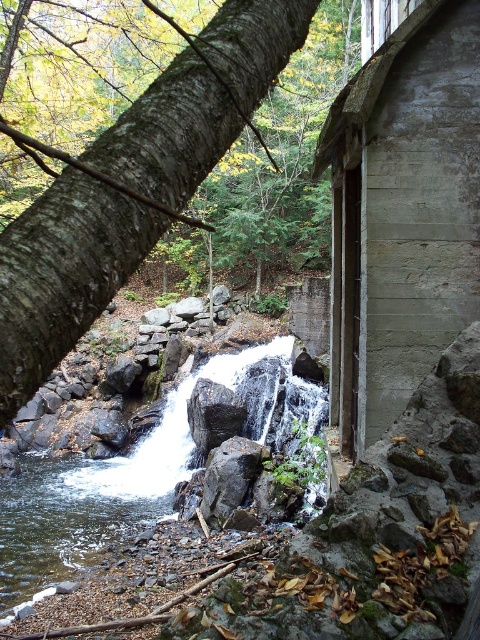
Is white smooth water at center taller than gray rough rock at center?

Correct, white smooth water at center is much taller as gray rough rock at center.

At what (x,y) coordinates should I click in order to perform the action: click on white smooth water at center. Please return your answer as a coordinate pair (x, y). This screenshot has width=480, height=640. Looking at the image, I should click on (132, 474).

Can you confirm if white smooth water at center is taller than clear water at center?

Indeed, white smooth water at center has a greater height compared to clear water at center.

Is white smooth water at center below clear water at center?

Incorrect, white smooth water at center is not positioned below clear water at center.

The image size is (480, 640). Describe the element at coordinates (132, 474) in the screenshot. I see `white smooth water at center` at that location.

Image resolution: width=480 pixels, height=640 pixels. Find the location of `white smooth water at center`. white smooth water at center is located at coordinates (132, 474).

Does concrete wall at right have a greater width compared to gray rough rock at center?

In fact, concrete wall at right might be narrower than gray rough rock at center.

Does concrete wall at right have a greater height compared to gray rough rock at center?

Incorrect, concrete wall at right's height is not larger of gray rough rock at center's.

This screenshot has width=480, height=640. What do you see at coordinates (402, 212) in the screenshot?
I see `concrete wall at right` at bounding box center [402, 212].

At what (x,y) coordinates should I click in order to perform the action: click on concrete wall at right. Please return your answer as a coordinate pair (x, y). This screenshot has width=480, height=640. Looking at the image, I should click on (402, 212).